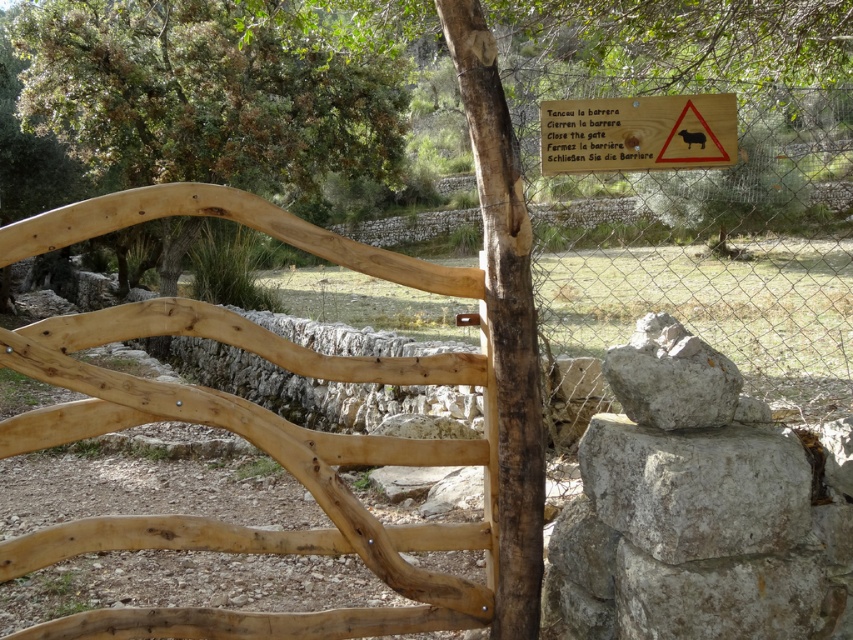
You are standing at the entrance of the scene and want to locate the natural wood gate at center. What are the coordinates where you can find it?

The natural wood gate at center can be found at coordinates point (259, 449).

You are standing in front of the natural wood gate at center and want to take a photo of the green leafy tree at upper left. Which object should you focus on first to ensure both are in frame?

You should focus on the natural wood gate at center first because it is closer to you than the green leafy tree at upper left, so adjusting focus starting from the closer object ensures both are in frame.